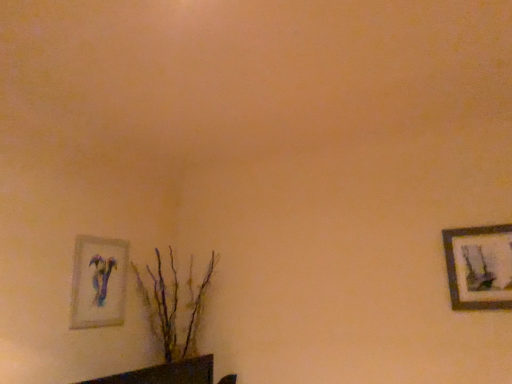
Question: Can you confirm if brown textured plant at lower left is thinner than matte glass picture frame at lower left, placed as the first picture frame when sorted from left to right?

Choices:
 (A) no
 (B) yes

Answer: (A)

Question: Is brown textured plant at lower left smaller than matte glass picture frame at lower left, the second picture frame viewed from the right?

Choices:
 (A) no
 (B) yes

Answer: (A)

Question: From the image's perspective, is brown textured plant at lower left above matte glass picture frame at lower left, placed as the first picture frame when sorted from left to right?

Choices:
 (A) yes
 (B) no

Answer: (B)

Question: From a real-world perspective, is brown textured plant at lower left over matte glass picture frame at lower left, placed as the first picture frame when sorted from left to right?

Choices:
 (A) no
 (B) yes

Answer: (A)

Question: Could matte glass picture frame at lower left, the second picture frame viewed from the right, be considered to be inside brown textured plant at lower left?

Choices:
 (A) no
 (B) yes

Answer: (A)

Question: Is matte glass picture frame at lower left, placed as the first picture frame when sorted from left to right, situated inside brown textured plant at lower left or outside?

Choices:
 (A) outside
 (B) inside

Answer: (A)

Question: In terms of size, does matte glass picture frame at lower left, placed as the first picture frame when sorted from left to right, appear bigger or smaller than brown textured plant at lower left?

Choices:
 (A) small
 (B) big

Answer: (A)

Question: From the image's perspective, is matte glass picture frame at lower left, the second picture frame viewed from the right, located above or below brown textured plant at lower left?

Choices:
 (A) above
 (B) below

Answer: (A)

Question: In terms of height, does matte glass picture frame at lower left, placed as the first picture frame when sorted from left to right, look taller or shorter compared to brown textured plant at lower left?

Choices:
 (A) tall
 (B) short

Answer: (B)

Question: From the image's perspective, is wooden framed artwork at right, which is the 2th picture frame from left to right, above or below brown textured plant at lower left?

Choices:
 (A) below
 (B) above

Answer: (B)

Question: In terms of width, does wooden framed artwork at right, which is counted as the first picture frame, starting from the right, look wider or thinner when compared to brown textured plant at lower left?

Choices:
 (A) wide
 (B) thin

Answer: (B)

Question: Is wooden framed artwork at right, which is the 2th picture frame from left to right, taller or shorter than brown textured plant at lower left?

Choices:
 (A) short
 (B) tall

Answer: (A)

Question: Is wooden framed artwork at right, which is the 2th picture frame from left to right, to the left or to the right of brown textured plant at lower left in the image?

Choices:
 (A) right
 (B) left

Answer: (A)

Question: From the image's perspective, is brown textured plant at lower left positioned above or below wooden framed artwork at right, which is counted as the first picture frame, starting from the right?

Choices:
 (A) above
 (B) below

Answer: (B)

Question: In the image, is brown textured plant at lower left positioned in front of or behind wooden framed artwork at right, which is counted as the first picture frame, starting from the right?

Choices:
 (A) behind
 (B) front

Answer: (A)